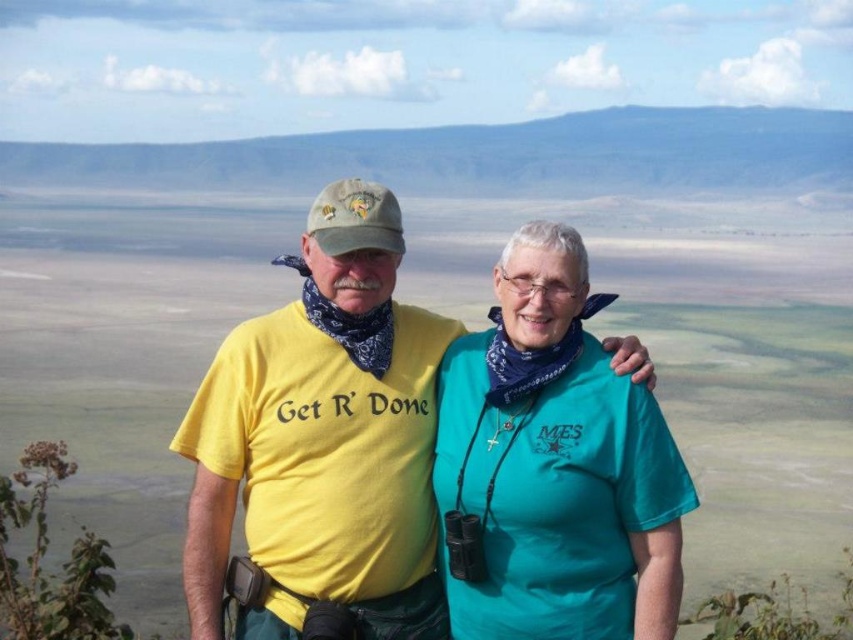
Between yellow matte t-shirt at center and teal fabric shirt at center, which one is positioned higher?

Positioned higher is teal fabric shirt at center.

Is point (299, 358) positioned before point (518, 237)?

No, (299, 358) is behind (518, 237).

Where is `yellow matte t-shirt at center`? yellow matte t-shirt at center is located at coordinates [323, 436].